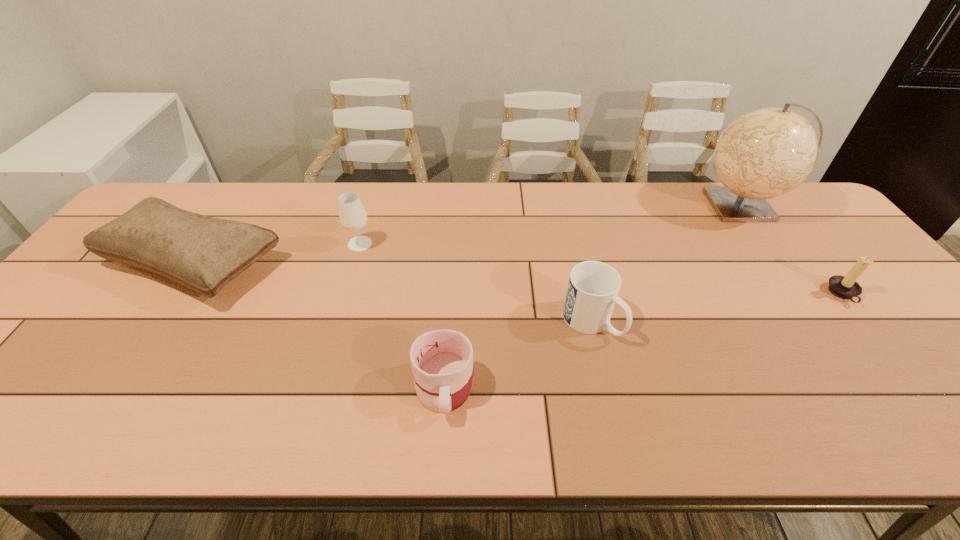
At what (x,y) coordinates should I click in order to perform the action: click on free space that satisfies the following two spatial constraints: 1. on the wick of the candle holder; 2. on the side with the handle of the shortest object. Please return your answer as a coordinate pair (x, y). This screenshot has width=960, height=540. Looking at the image, I should click on (915, 386).

What are the coordinates of `free location that satisfies the following two spatial constraints: 1. on the front side of the glass; 2. on the right side of the taller mug` in the screenshot? It's located at (337, 322).

You are a GUI agent. You are given a task and a screenshot of the screen. Output one action in this format:
    pyautogui.click(x=<x>, y=<y>)
    Task: Click on the free point that satisfies the following two spatial constraints: 1. on the wick of the candle holder; 2. on the front side of the taller mug
    The image size is (960, 540).
    Given the screenshot: What is the action you would take?
    pyautogui.click(x=864, y=322)